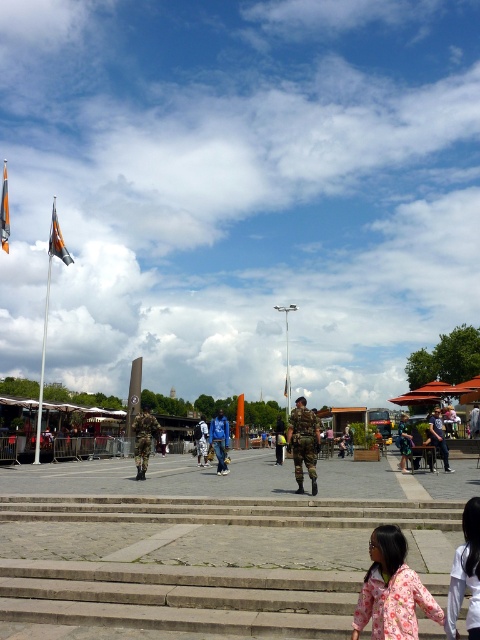
You are standing at the base of the stone steps in the public square. You see a person wearing a pink floral dress at lower right and someone holding a camera. How far apart are these two individuals?

The pink floral dress at lower right and the camera are 4.32 meters apart.